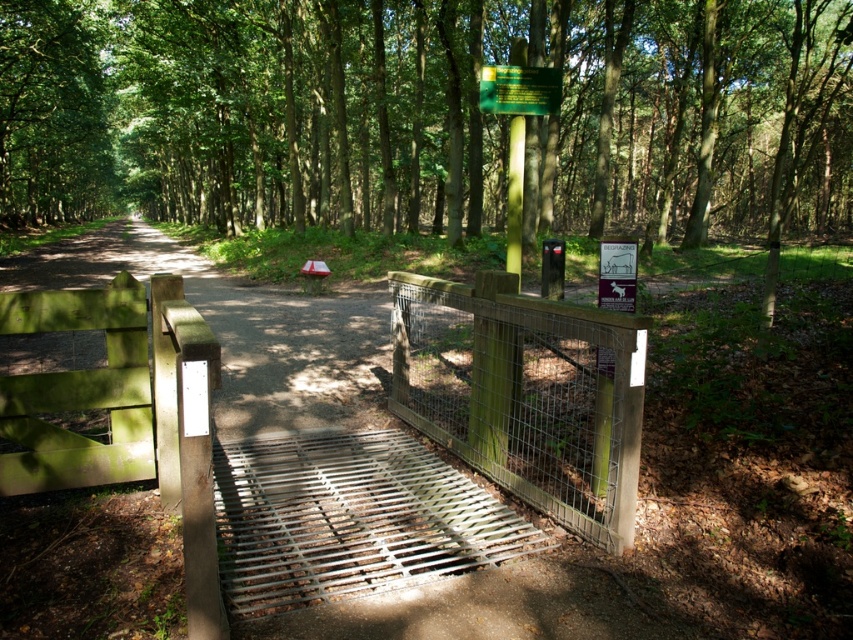
Question: Is wooden wire mesh gate at center to the left of green matte pole at center from the viewer's perspective?

Choices:
 (A) yes
 (B) no

Answer: (A)

Question: Which of the following is the farthest from the observer?

Choices:
 (A) green matte sign at upper center
 (B) wooden wire mesh gate at center

Answer: (A)

Question: Which is farther from the wooden wire mesh gate at center?

Choices:
 (A) green matte sign at upper center
 (B) green matte pole at center

Answer: (A)

Question: Is the position of wooden wire mesh gate at center less distant than that of green matte pole at center?

Choices:
 (A) no
 (B) yes

Answer: (B)

Question: Does green matte sign at upper center lie behind green matte pole at center?

Choices:
 (A) no
 (B) yes

Answer: (B)

Question: Considering the real-world distances, which object is closest to the green matte sign at upper center?

Choices:
 (A) wooden wire mesh gate at center
 (B) green matte pole at center

Answer: (B)